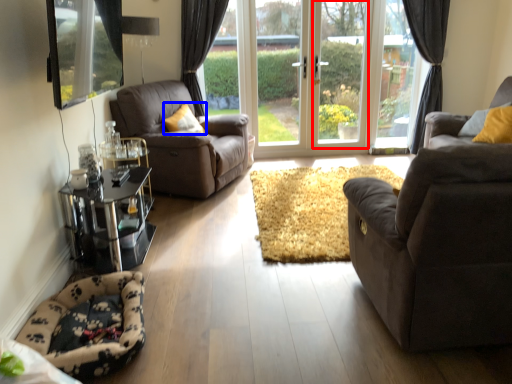
Question: Among these objects, which one is nearest to the camera, window frame (highlighted by a red box) or pillow (highlighted by a blue box)?

Choices:
 (A) window frame
 (B) pillow

Answer: (B)